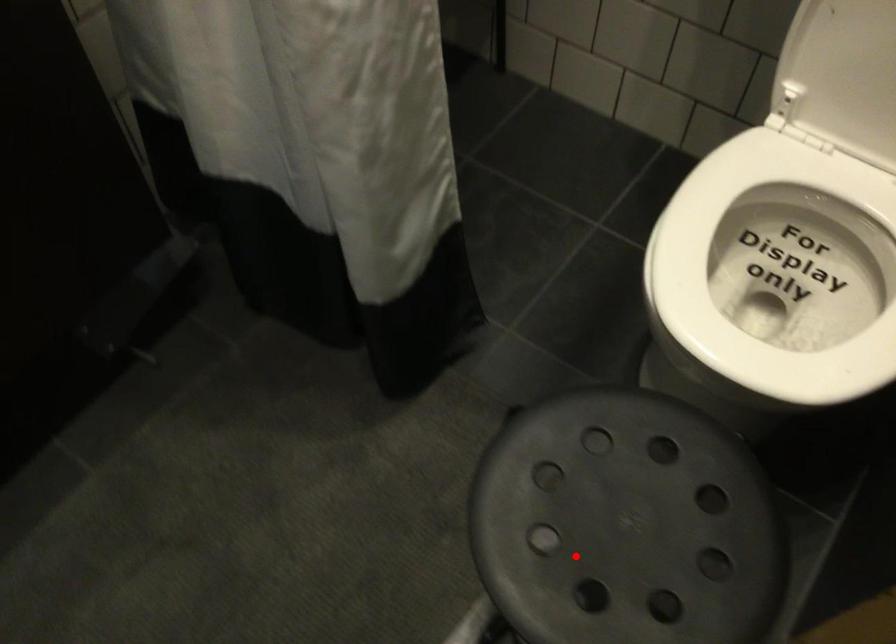
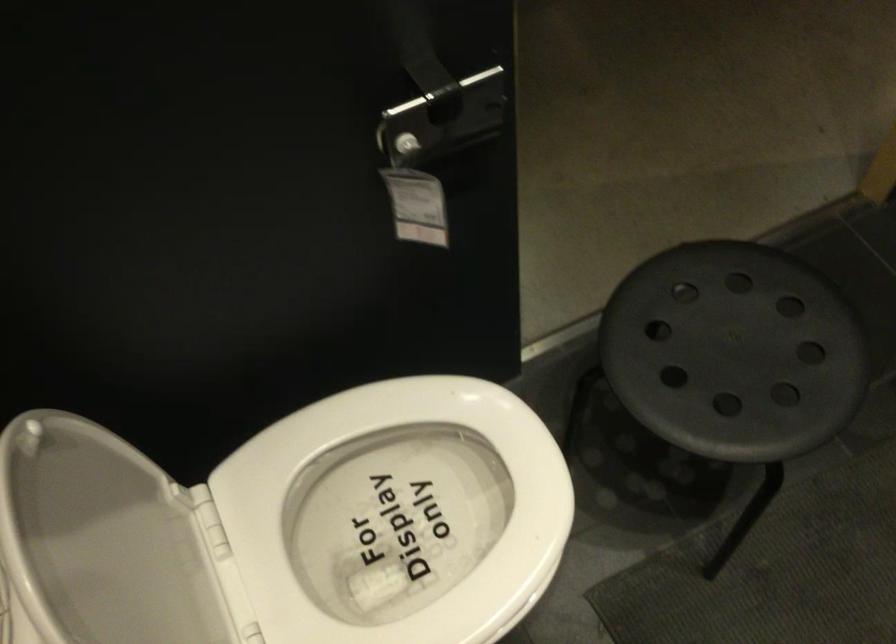
Question: A red point is marked in image1. In image2, is the corresponding 3D point closer to the camera or farther? Reply with the corresponding letter.

Choices:
 (A) The corresponding 3D point is closer.
 (B) The corresponding 3D point is farther.

Answer: (B)